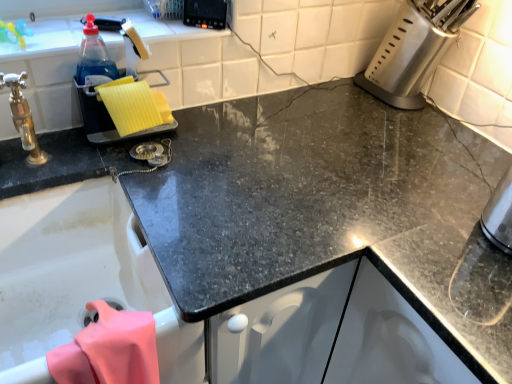
Where is `free space in front of yellow sponge at left, which is the 1th appliance in left-to-right order`? Image resolution: width=512 pixels, height=384 pixels. free space in front of yellow sponge at left, which is the 1th appliance in left-to-right order is located at coordinates (125, 180).